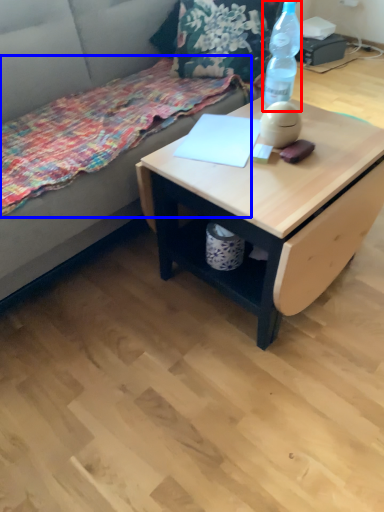
Question: Among these objects, which one is farthest to the camera, bottle (highlighted by a red box) or blanket (highlighted by a blue box)?

Choices:
 (A) bottle
 (B) blanket

Answer: (A)